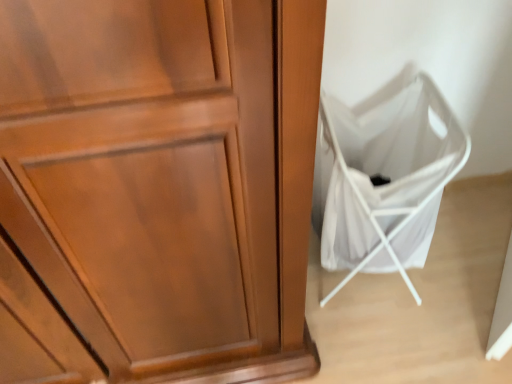
What are the coordinates of `white fabric baby carriage at right` in the screenshot? It's located at (384, 175).

The height and width of the screenshot is (384, 512). What do you see at coordinates (384, 175) in the screenshot?
I see `white fabric baby carriage at right` at bounding box center [384, 175].

Locate an element on the screen. Image resolution: width=512 pixels, height=384 pixels. white fabric baby carriage at right is located at coordinates (384, 175).